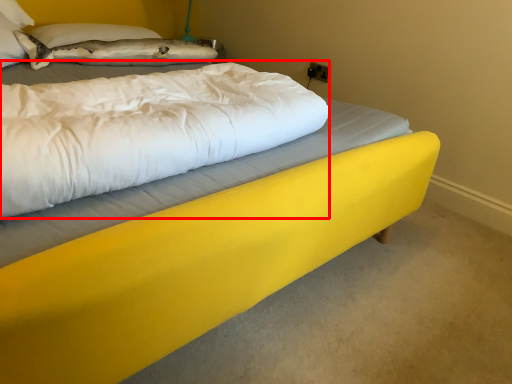
Question: From the image's perspective, what is the correct spatial positioning of mattress (annotated by the red box) in reference to pillow?

Choices:
 (A) above
 (B) below

Answer: (B)